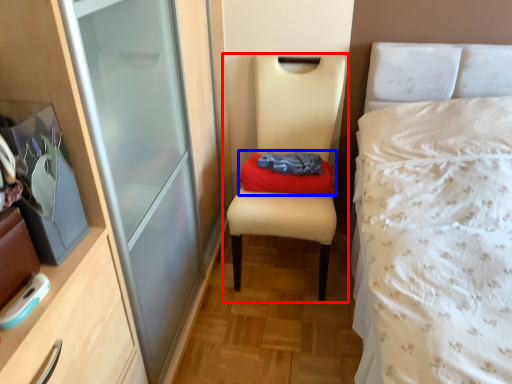
Question: Which of the following is the closest to the observer, chair (highlighted by a red box) or clothing (highlighted by a blue box)?

Choices:
 (A) chair
 (B) clothing

Answer: (A)